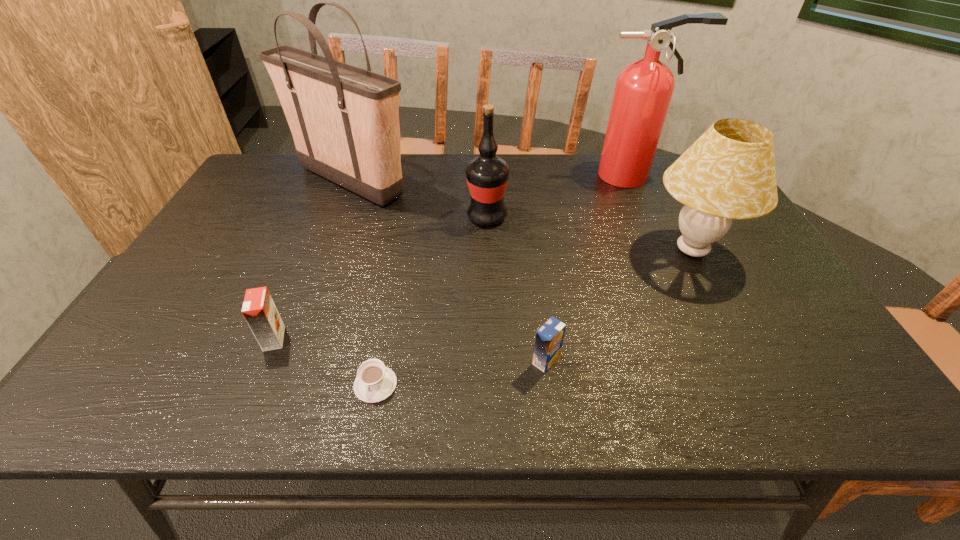
At what (x,y) coordinates should I click in order to perform the action: click on shopping bag. Please return your answer as a coordinate pair (x, y). Image resolution: width=960 pixels, height=540 pixels. Looking at the image, I should click on (344, 120).

You are a GUI agent. You are given a task and a screenshot of the screen. Output one action in this format:
    pyautogui.click(x=<x>, y=<y>)
    Task: Click on the fire extinguisher
    
    Given the screenshot: What is the action you would take?
    pyautogui.click(x=643, y=91)

This screenshot has width=960, height=540. Identify the location of lampshade. (729, 173).

Image resolution: width=960 pixels, height=540 pixels. I want to click on wine bottle, so click(x=487, y=175).

I want to click on the fifth tallest object, so click(259, 310).

You are a GUI agent. You are given a task and a screenshot of the screen. Output one action in this format:
    pyautogui.click(x=<x>, y=<y>)
    Task: Click on the left orange_juice
    
    Given the screenshot: What is the action you would take?
    pyautogui.click(x=259, y=310)

Locate an element on the screen. This screenshot has height=540, width=960. the shorter orange_juice is located at coordinates (549, 338).

Locate an element on the screen. The height and width of the screenshot is (540, 960). the second shortest object is located at coordinates (549, 338).

This screenshot has height=540, width=960. Identify the location of the shortest object. (375, 382).

The width and height of the screenshot is (960, 540). Find the location of `free region located on the right of the shopping bag`. free region located on the right of the shopping bag is located at coordinates (465, 181).